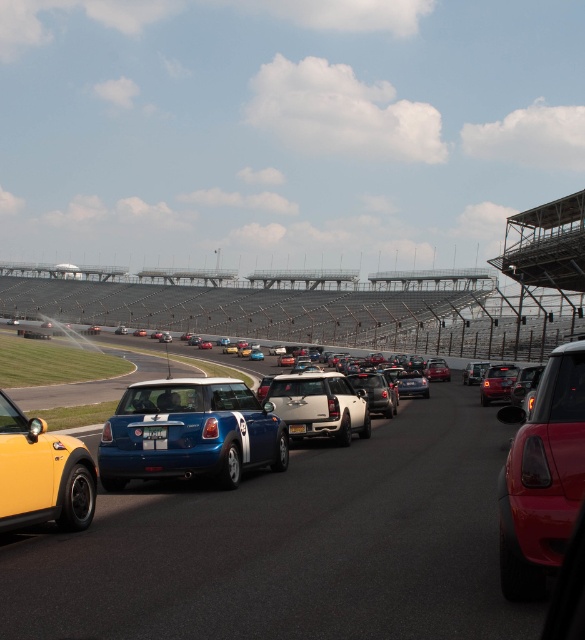
Question: Does shiny red car at right appear on the left side of white plastic license plate at center?

Choices:
 (A) yes
 (B) no

Answer: (B)

Question: Does shiny blue car at center appear on the left side of white plastic license plate at center?

Choices:
 (A) yes
 (B) no

Answer: (B)

Question: Which of the following is the farthest from the observer?

Choices:
 (A) smooth asphalt race track at center
 (B) shiny red car at right
 (C) yellow plastic license plate at center
 (D) satin white suv at center

Answer: (D)

Question: Is white plastic license plate at center closer to camera compared to yellow plastic license plate at center?

Choices:
 (A) no
 (B) yes

Answer: (B)

Question: Which of the following is the farthest from the observer?

Choices:
 (A) smooth asphalt race track at center
 (B) yellow plastic license plate at center

Answer: (B)

Question: Which object is the closest to the yellow plastic license plate at center?

Choices:
 (A) white plastic license plate at center
 (B) shiny red car at right
 (C) shiny yellow taxi at lower left

Answer: (A)